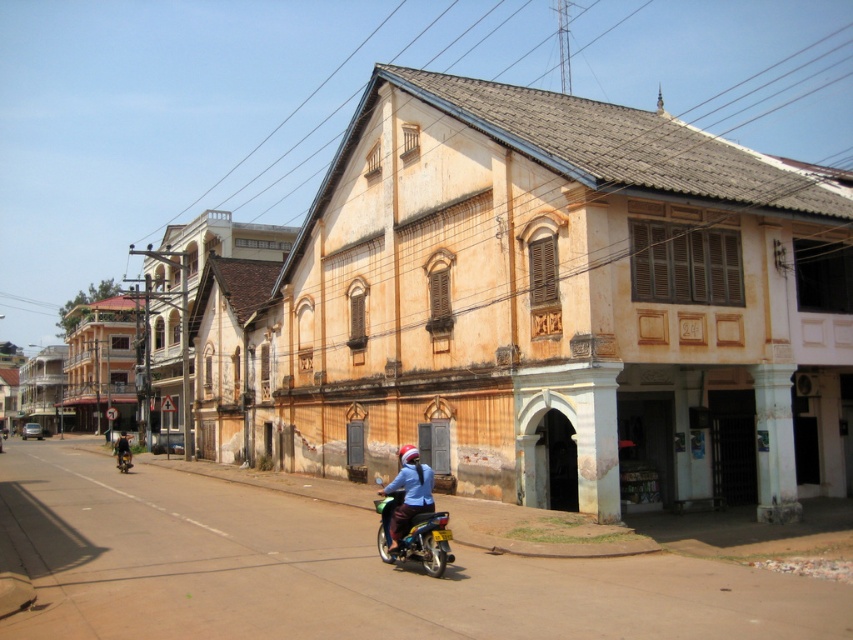
You are standing at point 0.5, 0.5 in the image. Which direction should you move to get closer to the beige textured building at center?

Since the beige textured building at center is located at point (538, 308) and you are at (426, 320), you should move slightly towards the northeast direction to get closer to the beige textured building at center.

You are a delivery driver who needs to park your metallic blue motorcycle at lower center near the dark blue fabric jacket at left. Is there enough space between them for you to step out safely?

The metallic blue motorcycle at lower center is located above the dark blue fabric jacket at left, meaning they are positioned vertically rather than horizontally. Therefore, there is sufficient vertical space between them for you to step out safely.

You are a delivery person who needs to deliver a package to the beige textured building at center. However, there is a blue fabric santa hat at center blocking the entrance. Can you walk around the hat to reach the building?

The beige textured building at center is positioned over the blue fabric santa hat at center, meaning the hat is directly in front of the building. Since the hat is blocking the entrance, you can walk around it to access the building.